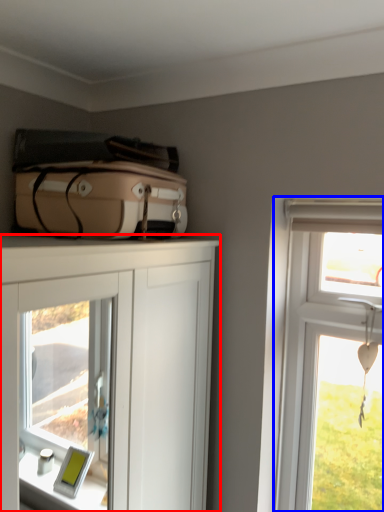
Question: Which of the following is the closest to the observer, cabinetry (highlighted by a red box) or window (highlighted by a blue box)?

Choices:
 (A) cabinetry
 (B) window

Answer: (A)